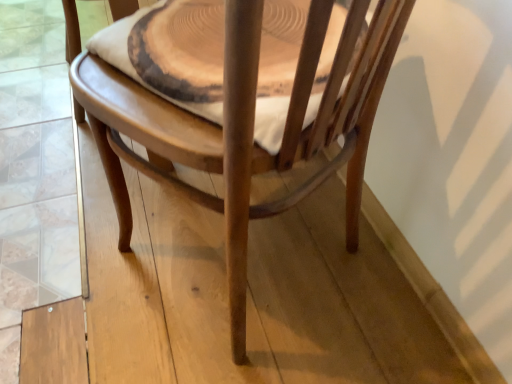
Question: From a real-world perspective, relative to wooden chair at center, is wooden round table at center vertically above or below?

Choices:
 (A) above
 (B) below

Answer: (A)

Question: Is point (263, 132) positioned closer to the camera than point (374, 21)?

Choices:
 (A) farther
 (B) closer

Answer: (A)

Question: Considering the relative positions of wooden round table at center and wooden chair at center in the image provided, is wooden round table at center to the left or to the right of wooden chair at center?

Choices:
 (A) left
 (B) right

Answer: (B)

Question: From the image's perspective, relative to wooden round table at center, is wooden chair at center above or below?

Choices:
 (A) above
 (B) below

Answer: (B)

Question: From a real-world perspective, is wooden chair at center physically located above or below wooden round table at center?

Choices:
 (A) above
 (B) below

Answer: (B)

Question: Is wooden chair at center inside the boundaries of wooden round table at center, or outside?

Choices:
 (A) outside
 (B) inside

Answer: (A)

Question: Is wooden chair at center taller or shorter than wooden round table at center?

Choices:
 (A) short
 (B) tall

Answer: (B)